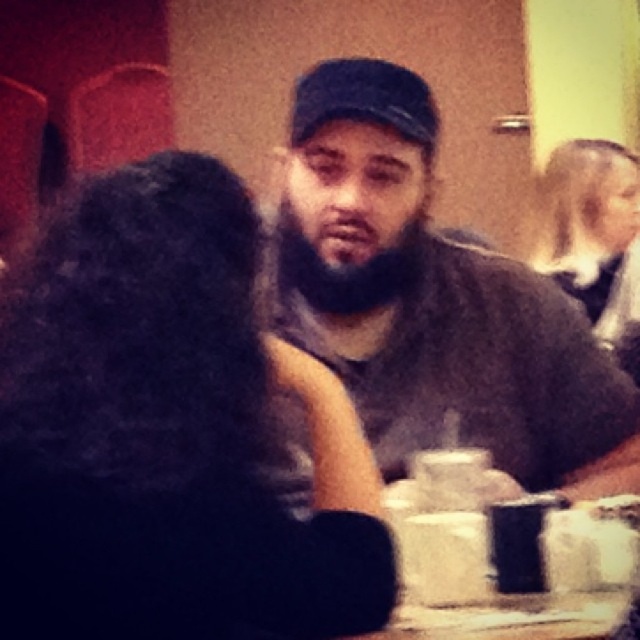
Question: Does dark gray t-shirt at center appear under black fabric baseball cap at center?

Choices:
 (A) yes
 (B) no

Answer: (A)

Question: Which object appears closest to the camera in this image?

Choices:
 (A) black fabric baseball cap at center
 (B) dark gray t-shirt at center

Answer: (B)

Question: Which point is farther to the camera?

Choices:
 (A) black fabric baseball cap at center
 (B) dark gray t-shirt at center

Answer: (A)

Question: Can you confirm if dark gray t-shirt at center is wider than black fabric baseball cap at center?

Choices:
 (A) yes
 (B) no

Answer: (A)

Question: Where is dark gray t-shirt at center located in relation to black fabric baseball cap at center in the image?

Choices:
 (A) above
 (B) below

Answer: (B)